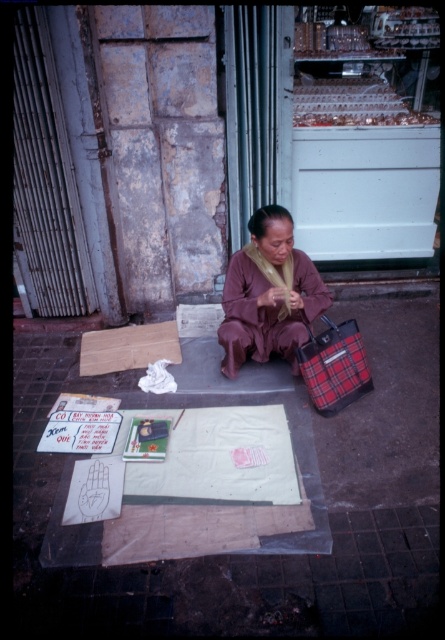
Does point (164, 624) lie behind point (315, 268)?

No, (164, 624) is closer to viewer.

Which is more to the right, smooth concrete surface at center or brown matte robe at center?

From the viewer's perspective, brown matte robe at center appears more on the right side.

Between point (90, 621) and point (300, 298), which one is positioned behind?

The point (300, 298) is more distant.

Where is `smooth concrete surface at center`? smooth concrete surface at center is located at coordinates (261, 556).